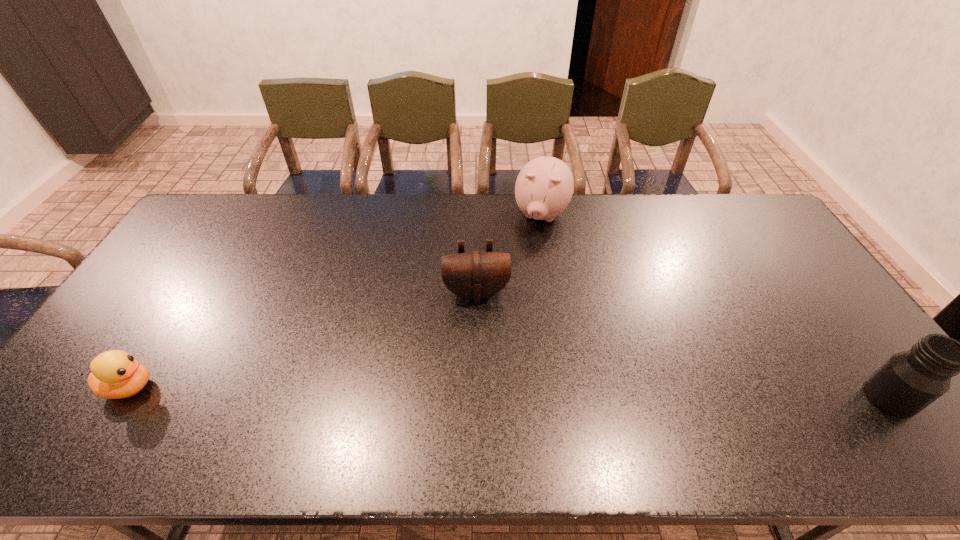
Where is `vacant space on the desktop that is between the duckling and the rightmost object and is positioned at the snout of the second object from right to left`? vacant space on the desktop that is between the duckling and the rightmost object and is positioned at the snout of the second object from right to left is located at coordinates (479, 392).

At what (x,y) coordinates should I click in order to perform the action: click on free space on the desktop that is between the duckling and the jar and is positioned with the flap open on the second farthest object. Please return your answer as a coordinate pair (x, y). This screenshot has width=960, height=540. Looking at the image, I should click on (484, 392).